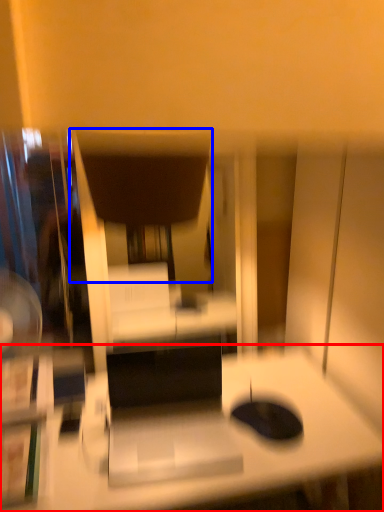
Question: Which object is closer to the camera taking this photo, desk (highlighted by a red box) or swivel chair (highlighted by a blue box)?

Choices:
 (A) desk
 (B) swivel chair

Answer: (A)